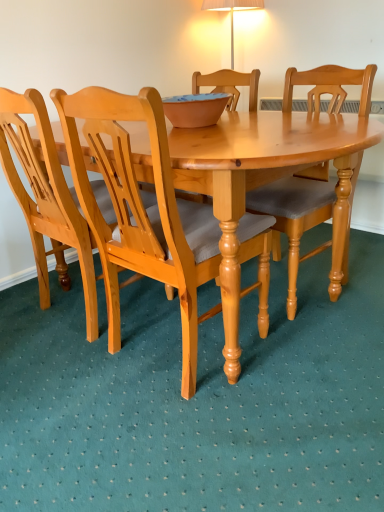
Find the location of a particular element. vacant space in front of light brown wood chair at center, which is counted as the first chair, starting from the right is located at coordinates (328, 341).